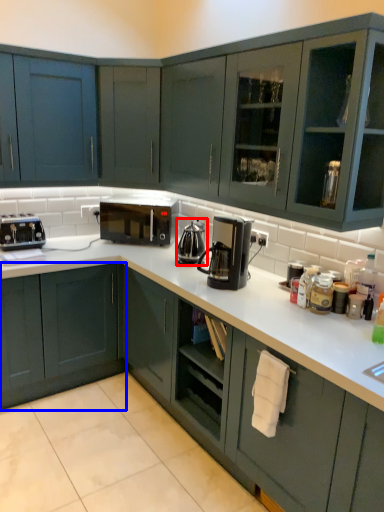
Question: Which point is closer to the camera, coffeepot (highlighted by a red box) or cabinetry (highlighted by a blue box)?

Choices:
 (A) coffeepot
 (B) cabinetry

Answer: (B)